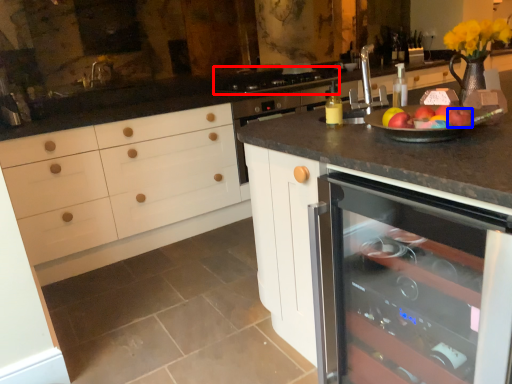
Question: Which object is further to the camera taking this photo, gas stove (highlighted by a red box) or apple (highlighted by a blue box)?

Choices:
 (A) gas stove
 (B) apple

Answer: (A)